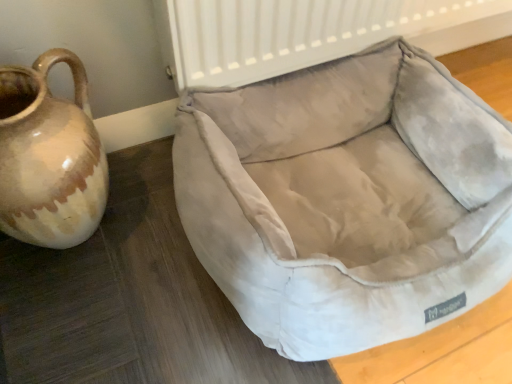
Where is `vacant space in front of brown glazed jug at left`? This screenshot has width=512, height=384. vacant space in front of brown glazed jug at left is located at coordinates (70, 308).